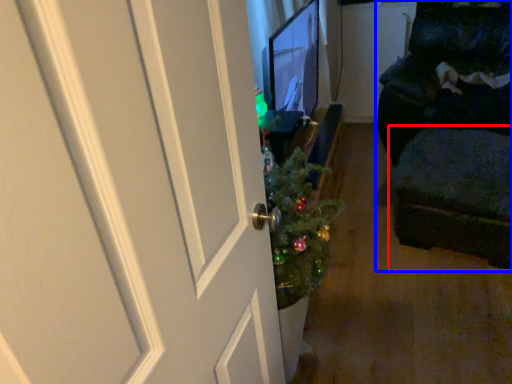
Question: Which point is closer to the camera, footrest (highlighted by a red box) or furniture (highlighted by a blue box)?

Choices:
 (A) footrest
 (B) furniture

Answer: (A)